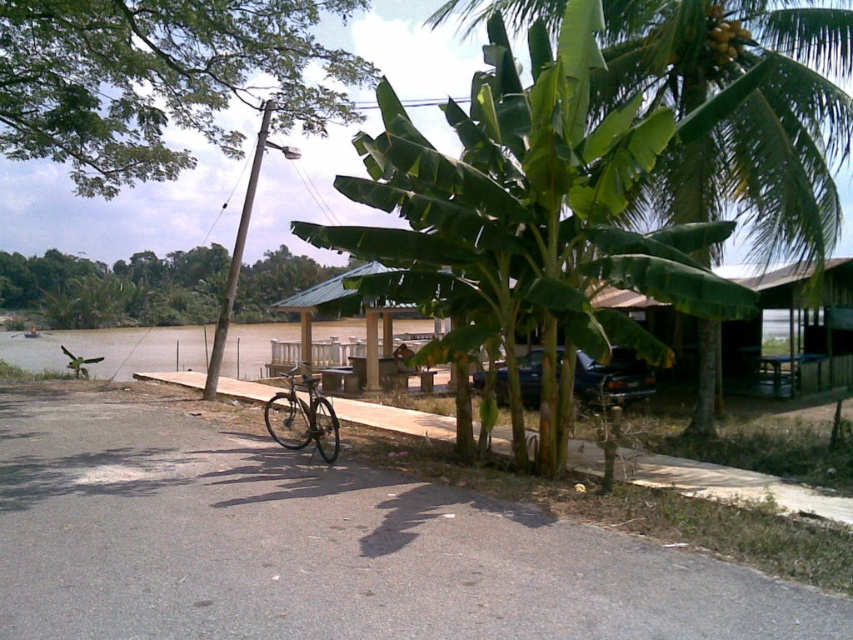
You are standing at the riverside and want to reach a specific point marked as point (732, 211). The point is 13.30 meters away from you. You have a measuring tape that can extend up to 12 meters. Can you reach the point with your measuring tape?

The point (732, 211) is 13.30 meters away from the viewer. Since the measuring tape can only extend up to 12 meters, you cannot reach the point with your measuring tape.